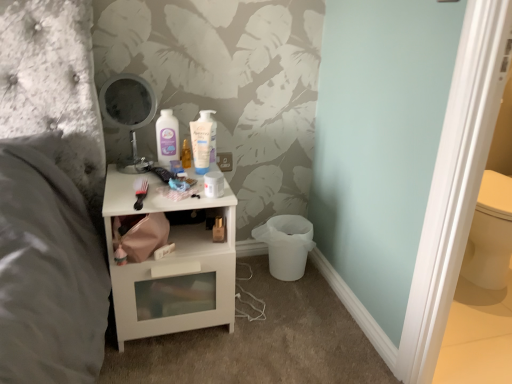
Describe the element at coordinates (170, 264) in the screenshot. The height and width of the screenshot is (384, 512). I see `white glossy nightstand at center` at that location.

Identify the location of white glossy mouthwash at center, which is the first mouthwash from right to left. (203, 141).

How different are the orientations of matte plastic mouthwash at center, positioned as the 2th mouthwash in right-to-left order, and white glossy mouthwash at center, which is the first mouthwash from right to left, in degrees?

The angle between the facing direction of matte plastic mouthwash at center, positioned as the 2th mouthwash in right-to-left order, and the facing direction of white glossy mouthwash at center, which is the first mouthwash from right to left, is 10.6 degrees.

Is matte plastic mouthwash at center, the 1th mouthwash from the left, with white glossy mouthwash at center, which is the first mouthwash from right to left?

No, matte plastic mouthwash at center, the 1th mouthwash from the left, is not with white glossy mouthwash at center, which is the first mouthwash from right to left.

Is white glossy mouthwash at center, which ranks as the 2th mouthwash in left-to-right order, inside matte plastic mouthwash at center, the 1th mouthwash from the left?

No, white glossy mouthwash at center, which ranks as the 2th mouthwash in left-to-right order, is not a part of matte plastic mouthwash at center, the 1th mouthwash from the left.

Considering the relative positions of matte plastic mouthwash at center, positioned as the 2th mouthwash in right-to-left order, and white glossy mouthwash at center, which is the first mouthwash from right to left, in the image provided, is matte plastic mouthwash at center, positioned as the 2th mouthwash in right-to-left order, to the left or to the right of white glossy mouthwash at center, which is the first mouthwash from right to left,?

matte plastic mouthwash at center, positioned as the 2th mouthwash in right-to-left order, is positioned on white glossy mouthwash at center, which is the first mouthwash from right to left,'s left side.

Does white glossy nightstand at center turn towards white glossy mouthwash at center, which is the first mouthwash from right to left?

No, white glossy nightstand at center is not turned towards white glossy mouthwash at center, which is the first mouthwash from right to left.

The width and height of the screenshot is (512, 384). There is a white glossy nightstand at center. In order to click on the 1st mouthwash above it (from a real-world perspective) in this screenshot , I will do `click(203, 141)`.

From the image's perspective, would you say white glossy nightstand at center is positioned over white glossy mouthwash at center, which ranks as the 2th mouthwash in left-to-right order?

Incorrect, from the image's perspective, white glossy nightstand at center is lower than white glossy mouthwash at center, which ranks as the 2th mouthwash in left-to-right order.

Is white glossy nightstand at center closer to camera compared to white glossy mouthwash at center, which ranks as the 2th mouthwash in left-to-right order?

Yes, white glossy nightstand at center is in front of white glossy mouthwash at center, which ranks as the 2th mouthwash in left-to-right order.

Does point (158, 148) come in front of point (130, 207)?

No.

In the image, is matte plastic mouthwash at center, positioned as the 2th mouthwash in right-to-left order, positioned in front of or behind white glossy nightstand at center?

In the image, matte plastic mouthwash at center, positioned as the 2th mouthwash in right-to-left order, appears behind white glossy nightstand at center.

Can you confirm if matte plastic mouthwash at center, positioned as the 2th mouthwash in right-to-left order, is taller than white glossy nightstand at center?

No, matte plastic mouthwash at center, positioned as the 2th mouthwash in right-to-left order, is not taller than white glossy nightstand at center.

Is white glossy mouthwash at center, which ranks as the 2th mouthwash in left-to-right order, surrounding white glossy nightstand at center?

Definitely not — white glossy nightstand at center is not inside white glossy mouthwash at center, which ranks as the 2th mouthwash in left-to-right order.

What's the angular difference between white glossy mouthwash at center, which is the first mouthwash from right to left, and white glossy nightstand at center's facing directions?

10.6 degrees separate the facing orientations of white glossy mouthwash at center, which is the first mouthwash from right to left, and white glossy nightstand at center.

Which object is wider, white glossy mouthwash at center, which is the first mouthwash from right to left, or white glossy nightstand at center?

white glossy nightstand at center.

From a real-world perspective, who is located lower, white glossy mouthwash at center, which ranks as the 2th mouthwash in left-to-right order, or white glossy nightstand at center?

white glossy nightstand at center.

Can you confirm if matte plastic mouthwash at center, positioned as the 2th mouthwash in right-to-left order, is bigger than metallic round mirror at upper center?

No, matte plastic mouthwash at center, positioned as the 2th mouthwash in right-to-left order, is not bigger than metallic round mirror at upper center.

Is matte plastic mouthwash at center, the 1th mouthwash from the left, inside or outside of metallic round mirror at upper center?

matte plastic mouthwash at center, the 1th mouthwash from the left, is located beyond the bounds of metallic round mirror at upper center.

Between matte plastic mouthwash at center, the 1th mouthwash from the left, and metallic round mirror at upper center, which one appears on the right side from the viewer's perspective?

matte plastic mouthwash at center, the 1th mouthwash from the left, is more to the right.

Based on the photo, does matte plastic mouthwash at center, the 1th mouthwash from the left, come in front of metallic round mirror at upper center?

No, the depth of matte plastic mouthwash at center, the 1th mouthwash from the left, is greater than that of metallic round mirror at upper center.

How different are the orientations of white glossy nightstand at center and matte plastic mouthwash at center, the 1th mouthwash from the left, in degrees?

The angle between the facing direction of white glossy nightstand at center and the facing direction of matte plastic mouthwash at center, the 1th mouthwash from the left, is 0.00125 degrees.

Considering the sizes of objects white glossy nightstand at center and matte plastic mouthwash at center, the 1th mouthwash from the left, in the image provided, who is smaller, white glossy nightstand at center or matte plastic mouthwash at center, the 1th mouthwash from the left,?

Smaller between the two is matte plastic mouthwash at center, the 1th mouthwash from the left.

From the picture: Can we say white glossy nightstand at center lies outside matte plastic mouthwash at center, the 1th mouthwash from the left?

Yes.

Is matte plastic mouthwash at center, the 1th mouthwash from the left, at the back of white glossy nightstand at center?

No, white glossy nightstand at center is not facing the opposite direction of matte plastic mouthwash at center, the 1th mouthwash from the left.

From the image's perspective, is white glossy mouthwash at center, which is the first mouthwash from right to left, above or below metallic round mirror at upper center?

Clearly, from the image's perspective, white glossy mouthwash at center, which is the first mouthwash from right to left, is below metallic round mirror at upper center.

Is point (202, 152) closer to camera compared to point (134, 143)?

Yes, point (202, 152) is in front of point (134, 143).

Identify the location of mouthwash that is the 2nd object to the right of the metallic round mirror at upper center, starting at the anchor. (203, 141).

Can you tell me how much white glossy mouthwash at center, which ranks as the 2th mouthwash in left-to-right order, and metallic round mirror at upper center differ in facing direction?

The angle between the facing direction of white glossy mouthwash at center, which ranks as the 2th mouthwash in left-to-right order, and the facing direction of metallic round mirror at upper center is 10.6 degrees.

The image size is (512, 384). What are the coordinates of `mouthwash that appears below the matte plastic mouthwash at center, the 1th mouthwash from the left (from the image's perspective)` in the screenshot? It's located at (203, 141).

Where is `mouthwash located on the right of white glossy nightstand at center`? The height and width of the screenshot is (384, 512). mouthwash located on the right of white glossy nightstand at center is located at coordinates (203, 141).

Considering their positions, is white glossy nightstand at center positioned closer to matte plastic mouthwash at center, positioned as the 2th mouthwash in right-to-left order, than white glossy mouthwash at center, which is the first mouthwash from right to left?

white glossy mouthwash at center, which is the first mouthwash from right to left, is positioned closer to the anchor matte plastic mouthwash at center, positioned as the 2th mouthwash in right-to-left order.

From the image, which object appears to be farther from white glossy nightstand at center, matte plastic mouthwash at center, the 1th mouthwash from the left, or metallic round mirror at upper center?

Based on the image, matte plastic mouthwash at center, the 1th mouthwash from the left, appears to be further to white glossy nightstand at center.

Consider the image. Looking at the image, which one is located closer to metallic round mirror at upper center, matte plastic mouthwash at center, the 1th mouthwash from the left, or white glossy mouthwash at center, which is the first mouthwash from right to left?

Among the two, matte plastic mouthwash at center, the 1th mouthwash from the left, is located nearer to metallic round mirror at upper center.

Estimate the real-world distances between objects in this image. Which object is further from white glossy mouthwash at center, which ranks as the 2th mouthwash in left-to-right order, matte plastic mouthwash at center, positioned as the 2th mouthwash in right-to-left order, or metallic round mirror at upper center?

metallic round mirror at upper center lies further to white glossy mouthwash at center, which ranks as the 2th mouthwash in left-to-right order, than the other object.

When comparing their distances from white glossy mouthwash at center, which ranks as the 2th mouthwash in left-to-right order, does metallic round mirror at upper center or white glossy nightstand at center seem closer?

metallic round mirror at upper center.

In the scene shown: Estimate the real-world distances between objects in this image. Which object is closer to white glossy mouthwash at center, which is the first mouthwash from right to left, white glossy nightstand at center or metallic round mirror at upper center?

Based on the image, metallic round mirror at upper center appears to be nearer to white glossy mouthwash at center, which is the first mouthwash from right to left.

From the image, which object appears to be nearer to matte plastic mouthwash at center, positioned as the 2th mouthwash in right-to-left order, white glossy mouthwash at center, which ranks as the 2th mouthwash in left-to-right order, or white glossy nightstand at center?

white glossy mouthwash at center, which ranks as the 2th mouthwash in left-to-right order, is positioned closer to the anchor matte plastic mouthwash at center, positioned as the 2th mouthwash in right-to-left order.

Considering their positions, is white glossy nightstand at center positioned closer to metallic round mirror at upper center than matte plastic mouthwash at center, positioned as the 2th mouthwash in right-to-left order?

matte plastic mouthwash at center, positioned as the 2th mouthwash in right-to-left order, lies closer to metallic round mirror at upper center than the other object.

Identify the location of mouthwash between metallic round mirror at upper center and white glossy mouthwash at center, which ranks as the 2th mouthwash in left-to-right order, in the horizontal direction. (167, 138).

This screenshot has width=512, height=384. In order to click on mouthwash between matte plastic mouthwash at center, the 1th mouthwash from the left, and white glossy nightstand at center from top to bottom in this screenshot , I will do `click(203, 141)`.